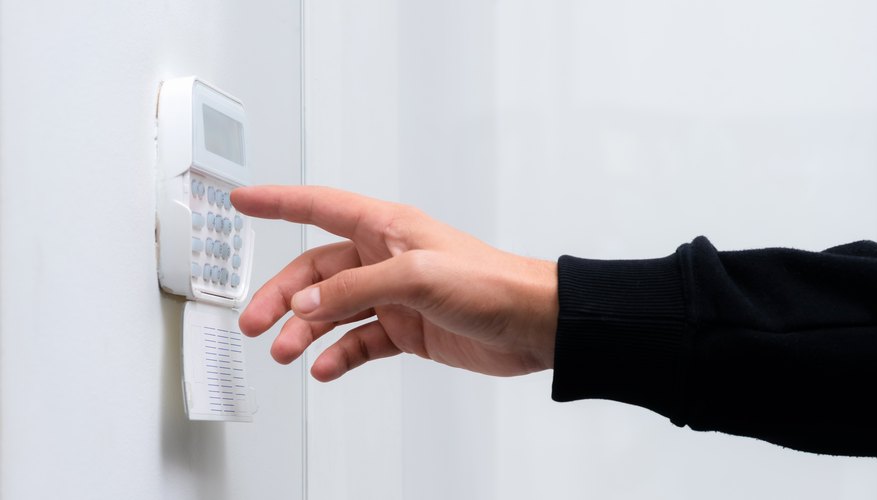
The image size is (877, 500). What are the coordinates of `control remote` in the screenshot? It's located at (209, 228).